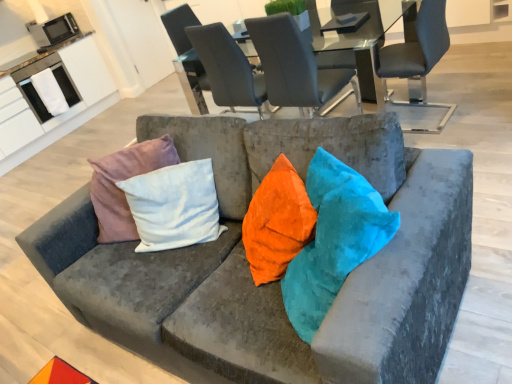
In the scene shown: Measure the distance between point (x=420, y=71) and camera.

Point (x=420, y=71) is 8.49 feet away from camera.

The width and height of the screenshot is (512, 384). Describe the element at coordinates (36, 91) in the screenshot. I see `white towel at upper left, the second appliance viewed from the top` at that location.

Find the location of a particular element. clear glass table at center is located at coordinates (360, 40).

The width and height of the screenshot is (512, 384). I want to click on suede-like gray chair at upper center, placed as the third chair when sorted from left to right, so click(355, 45).

Considering the relative positions of velvet gray chair at center, the third chair when ordered from right to left, and suede-like gray chair at upper center, the 2th chair from the right, in the image provided, is velvet gray chair at center, the third chair when ordered from right to left, to the left of suede-like gray chair at upper center, the 2th chair from the right, from the viewer's perspective?

Yes, velvet gray chair at center, the third chair when ordered from right to left, is to the left of suede-like gray chair at upper center, the 2th chair from the right.

Which object is wider, velvet gray chair at center, the third chair when ordered from right to left, or suede-like gray chair at upper center, placed as the third chair when sorted from left to right?

velvet gray chair at center, the third chair when ordered from right to left.

Are velvet gray chair at center, which ranks as the 2th chair in left-to-right order, and suede-like gray chair at upper center, the 2th chair from the right, located far from each other?

No.

Is velvet gray chair at center, which ranks as the 2th chair in left-to-right order, positioned beyond the bounds of suede-like gray chair at upper center, placed as the third chair when sorted from left to right?

Yes, velvet gray chair at center, which ranks as the 2th chair in left-to-right order, is outside of suede-like gray chair at upper center, placed as the third chair when sorted from left to right.

Does velvet gray couch at center appear on the left side of metallic microwave at upper left, the first appliance from the top?

Incorrect, velvet gray couch at center is not on the left side of metallic microwave at upper left, the first appliance from the top.

How far apart are velvet gray couch at center and metallic microwave at upper left, the first appliance from the top?

velvet gray couch at center and metallic microwave at upper left, the first appliance from the top, are 4.70 meters apart from each other.

Considering the positions of point (384, 284) and point (51, 26), is point (384, 284) closer or farther from the camera than point (51, 26)?

Point (384, 284) appears to be closer to the viewer than point (51, 26).

Image resolution: width=512 pixels, height=384 pixels. Find the location of `studio couch in front of the metallic microwave at upper left, the first appliance from the top`. studio couch in front of the metallic microwave at upper left, the first appliance from the top is located at coordinates (276, 282).

From the image's perspective, which one is positioned lower, metallic microwave at upper left, positioned as the second appliance in bottom-to-top order, or velvet gray chair at center, the third chair when ordered from right to left?

velvet gray chair at center, the third chair when ordered from right to left, is shown below in the image.

Considering the relative sizes of metallic microwave at upper left, the first appliance from the top, and velvet gray chair at center, which ranks as the 2th chair in left-to-right order, in the image provided, is metallic microwave at upper left, the first appliance from the top, bigger than velvet gray chair at center, which ranks as the 2th chair in left-to-right order,?

Actually, metallic microwave at upper left, the first appliance from the top, might be smaller than velvet gray chair at center, which ranks as the 2th chair in left-to-right order.

Consider the image. Considering the sizes of objects metallic microwave at upper left, positioned as the second appliance in bottom-to-top order, and velvet gray chair at center, which ranks as the 2th chair in left-to-right order, in the image provided, who is wider, metallic microwave at upper left, positioned as the second appliance in bottom-to-top order, or velvet gray chair at center, which ranks as the 2th chair in left-to-right order,?

velvet gray chair at center, which ranks as the 2th chair in left-to-right order, is wider.

How different are the orientations of metallic microwave at upper left, the first appliance from the top, and velvet gray chair at center, the third chair when ordered from right to left, in degrees?

88.1 degrees separate the facing orientations of metallic microwave at upper left, the first appliance from the top, and velvet gray chair at center, the third chair when ordered from right to left.

Is matte gray chair at upper right, marked as the 4th chair in a left-to-right arrangement, with metallic microwave at upper left, the first appliance from the top?

matte gray chair at upper right, marked as the 4th chair in a left-to-right arrangement, and metallic microwave at upper left, the first appliance from the top, are not in contact.

Does matte gray chair at upper right, which is the 1th chair in right-to-left order, contain metallic microwave at upper left, positioned as the second appliance in bottom-to-top order?

No, metallic microwave at upper left, positioned as the second appliance in bottom-to-top order, is not surrounded by matte gray chair at upper right, which is the 1th chair in right-to-left order.

Between matte gray chair at upper right, which is the 1th chair in right-to-left order, and metallic microwave at upper left, positioned as the second appliance in bottom-to-top order, which one has less height?

metallic microwave at upper left, positioned as the second appliance in bottom-to-top order.

Would you say velvet gray couch at center is to the left or to the right of matte gray chair at upper center, which is the 4th chair from right to left, in the picture?

In the image, velvet gray couch at center appears on the right side of matte gray chair at upper center, which is the 4th chair from right to left.

In the image, there is a matte gray chair at upper center, which is the 1th chair in left-to-right order. Where is `studio couch below it (from a real-world perspective)`? studio couch below it (from a real-world perspective) is located at coordinates (276, 282).

In terms of height, does velvet gray couch at center look taller or shorter compared to matte gray chair at upper center, which is the 1th chair in left-to-right order?

Clearly, velvet gray couch at center is shorter compared to matte gray chair at upper center, which is the 1th chair in left-to-right order.

Can you tell me how much clear glass table at center and matte gray chair at upper center, which is the 4th chair from right to left, differ in facing direction?

They differ by 87.7 degrees in their facing directions.

Is point (380, 106) closer to camera compared to point (178, 48)?

No.

Looking at this image, would you say clear glass table at center is to the left or to the right of matte gray chair at upper center, which is the 1th chair in left-to-right order, in the picture?

Clearly, clear glass table at center is on the right of matte gray chair at upper center, which is the 1th chair in left-to-right order, in the image.

From the picture: From the image's perspective, is clear glass table at center below matte gray chair at upper center, which is the 1th chair in left-to-right order?

Correct, clear glass table at center appears lower than matte gray chair at upper center, which is the 1th chair in left-to-right order, in the image.

From a real-world perspective, is metallic microwave at upper left, positioned as the second appliance in bottom-to-top order, physically located above or below suede-like gray chair at upper center, placed as the third chair when sorted from left to right?

metallic microwave at upper left, positioned as the second appliance in bottom-to-top order, is situated higher than suede-like gray chair at upper center, placed as the third chair when sorted from left to right, in the real world.

Which is correct: metallic microwave at upper left, positioned as the second appliance in bottom-to-top order, is inside suede-like gray chair at upper center, placed as the third chair when sorted from left to right, or outside of it?

metallic microwave at upper left, positioned as the second appliance in bottom-to-top order, cannot be found inside suede-like gray chair at upper center, placed as the third chair when sorted from left to right.

Locate an element on the screen. the 2nd chair located above the suede-like gray chair at upper center, placed as the third chair when sorted from left to right (from a real-world perspective) is located at coordinates (296, 67).

In the image, there is a metallic microwave at upper left, positioned as the second appliance in bottom-to-top order. At what (x,y) coordinates should I click in order to perform the action: click on studio couch below it (from the image's perspective). Please return your answer as a coordinate pair (x, y). Looking at the image, I should click on (276, 282).

When comparing their distances from matte gray chair at upper center, which is the 4th chair from right to left, does suede-like gray chair at upper center, placed as the third chair when sorted from left to right, or velvet gray couch at center seem closer?

suede-like gray chair at upper center, placed as the third chair when sorted from left to right, is positioned closer to the anchor matte gray chair at upper center, which is the 4th chair from right to left.

Looking at the image, which one is located closer to matte gray chair at upper right, which is the 1th chair in right-to-left order, suede-like gray chair at upper center, placed as the third chair when sorted from left to right, or velvet gray couch at center?

suede-like gray chair at upper center, placed as the third chair when sorted from left to right, is closer to matte gray chair at upper right, which is the 1th chair in right-to-left order.

From the image, which object appears to be nearer to velvet gray couch at center, matte gray chair at upper right, marked as the 4th chair in a left-to-right arrangement, or suede-like gray chair at upper center, placed as the third chair when sorted from left to right?

Among the two, matte gray chair at upper right, marked as the 4th chair in a left-to-right arrangement, is located nearer to velvet gray couch at center.

When comparing their distances from white towel at upper left, acting as the first appliance starting from the bottom, does metallic microwave at upper left, the first appliance from the top, or suede-like gray chair at upper center, placed as the third chair when sorted from left to right, seem closer?

metallic microwave at upper left, the first appliance from the top.

Estimate the real-world distances between objects in this image. Which object is closer to metallic microwave at upper left, positioned as the second appliance in bottom-to-top order, suede-like gray chair at upper center, the 2th chair from the right, or matte gray chair at upper center, which is the 4th chair from right to left?

matte gray chair at upper center, which is the 4th chair from right to left, is closer to metallic microwave at upper left, positioned as the second appliance in bottom-to-top order.

Which object lies nearer to the anchor point matte gray chair at upper right, which is the 1th chair in right-to-left order, white towel at upper left, acting as the first appliance starting from the bottom, or velvet gray chair at center, which ranks as the 2th chair in left-to-right order?

velvet gray chair at center, which ranks as the 2th chair in left-to-right order.

Considering their positions, is clear glass table at center positioned closer to matte gray chair at upper right, marked as the 4th chair in a left-to-right arrangement, than metallic microwave at upper left, the first appliance from the top?

clear glass table at center is closer to matte gray chair at upper right, marked as the 4th chair in a left-to-right arrangement.

Based on their spatial positions, is metallic microwave at upper left, the first appliance from the top, or matte gray chair at upper right, which is the 1th chair in right-to-left order, closer to velvet gray couch at center?

matte gray chair at upper right, which is the 1th chair in right-to-left order.

Locate an element on the screen. chair between velvet gray chair at center, the third chair when ordered from right to left, and matte gray chair at upper right, marked as the 4th chair in a left-to-right arrangement is located at coordinates (355, 45).

Where is `table between matte gray chair at upper center, which is the 4th chair from right to left, and matte gray chair at upper right, marked as the 4th chair in a left-to-right arrangement, from left to right`? The width and height of the screenshot is (512, 384). table between matte gray chair at upper center, which is the 4th chair from right to left, and matte gray chair at upper right, marked as the 4th chair in a left-to-right arrangement, from left to right is located at coordinates (360, 40).

Where is `table located between velvet gray chair at center, the third chair when ordered from right to left, and suede-like gray chair at upper center, placed as the third chair when sorted from left to right, in the depth direction`? This screenshot has width=512, height=384. table located between velvet gray chair at center, the third chair when ordered from right to left, and suede-like gray chair at upper center, placed as the third chair when sorted from left to right, in the depth direction is located at coordinates (360, 40).

Find the location of a particular element. Image resolution: width=512 pixels, height=384 pixels. chair located between clear glass table at center and matte gray chair at upper right, marked as the 4th chair in a left-to-right arrangement, in the left-right direction is located at coordinates 355,45.